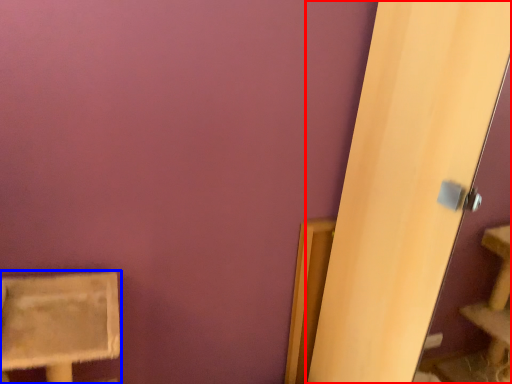
Question: Which object is closer to the camera taking this photo, screen door (highlighted by a red box) or furniture (highlighted by a blue box)?

Choices:
 (A) screen door
 (B) furniture

Answer: (A)